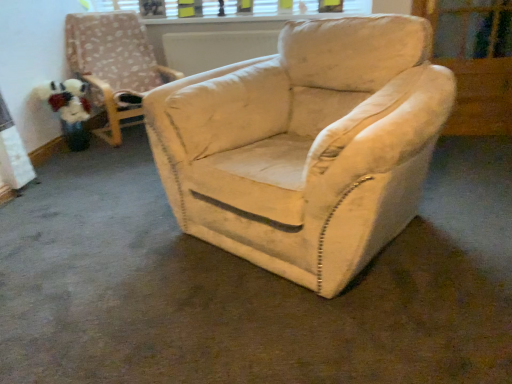
Question: Is transparent glass screen door at upper right at the left side of white plastic window frame at upper center?

Choices:
 (A) no
 (B) yes

Answer: (A)

Question: Considering the relative sizes of transparent glass screen door at upper right and white plastic window frame at upper center in the image provided, is transparent glass screen door at upper right wider than white plastic window frame at upper center?

Choices:
 (A) yes
 (B) no

Answer: (A)

Question: Is transparent glass screen door at upper right to the right of white plastic window frame at upper center from the viewer's perspective?

Choices:
 (A) no
 (B) yes

Answer: (B)

Question: From a real-world perspective, is transparent glass screen door at upper right physically below white plastic window frame at upper center?

Choices:
 (A) yes
 (B) no

Answer: (A)

Question: Considering the relative positions of transparent glass screen door at upper right and white plastic window frame at upper center in the image provided, is transparent glass screen door at upper right in front of white plastic window frame at upper center?

Choices:
 (A) yes
 (B) no

Answer: (A)

Question: Based on their sizes in the image, would you say transparent glass screen door at upper right is bigger or smaller than white plastic window frame at upper center?

Choices:
 (A) big
 (B) small

Answer: (A)

Question: Which is correct: transparent glass screen door at upper right is inside white plastic window frame at upper center, or outside of it?

Choices:
 (A) inside
 (B) outside

Answer: (B)

Question: From the image's perspective, relative to white plastic window frame at upper center, is transparent glass screen door at upper right above or below?

Choices:
 (A) above
 (B) below

Answer: (B)

Question: Is point (464, 112) positioned closer to the camera than point (245, 13)?

Choices:
 (A) closer
 (B) farther

Answer: (A)

Question: Looking at the image, does velvet beige armchair at center seem bigger or smaller compared to fluffy fabric toy at left?

Choices:
 (A) big
 (B) small

Answer: (A)

Question: From a real-world perspective, is velvet beige armchair at center physically located above or below fluffy fabric toy at left?

Choices:
 (A) below
 (B) above

Answer: (B)

Question: Is point (101, 16) closer or farther from the camera than point (81, 137)?

Choices:
 (A) farther
 (B) closer

Answer: (A)

Question: Would you say velvet beige armchair at center is to the left or to the right of fluffy fabric toy at left in the picture?

Choices:
 (A) left
 (B) right

Answer: (B)

Question: In the image, is white plastic window frame at upper center positioned in front of or behind transparent glass screen door at upper right?

Choices:
 (A) behind
 (B) front

Answer: (A)

Question: Choose the correct answer: Is white plastic window frame at upper center inside transparent glass screen door at upper right or outside it?

Choices:
 (A) outside
 (B) inside

Answer: (A)